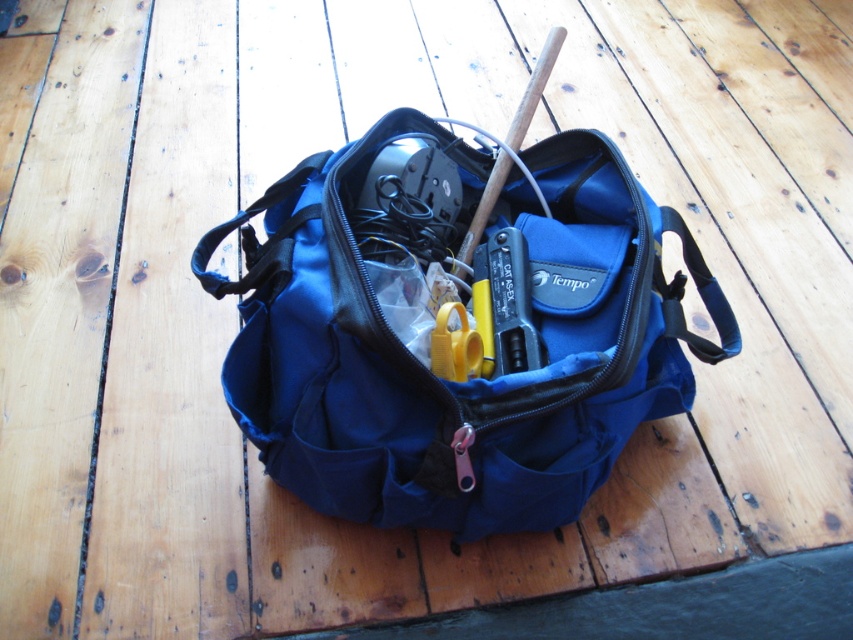
Question: Among these objects, which one is nearest to the camera?

Choices:
 (A) blue fabric tool bag at center
 (B) yellow plastic scissors at center
 (C) metallic gray tool at center

Answer: (A)

Question: Is blue fabric tool bag at center to the left of metallic gray tool at center from the viewer's perspective?

Choices:
 (A) no
 (B) yes

Answer: (B)

Question: Which object is the closest to the yellow plastic scissors at center?

Choices:
 (A) blue fabric tool bag at center
 (B) metallic gray tool at center

Answer: (B)

Question: Estimate the real-world distances between objects in this image. Which object is closer to the yellow plastic scissors at center?

Choices:
 (A) blue fabric tool bag at center
 (B) metallic gray tool at center

Answer: (B)

Question: Is blue fabric tool bag at center wider than yellow plastic scissors at center?

Choices:
 (A) yes
 (B) no

Answer: (A)

Question: Does blue fabric tool bag at center have a lesser width compared to yellow plastic scissors at center?

Choices:
 (A) no
 (B) yes

Answer: (A)